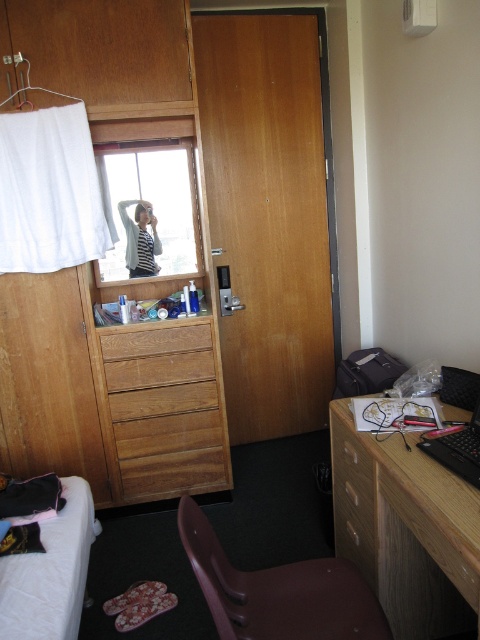
You are organizing your dorm room and want to place a tall plant between the brown wooden drawer at center and the wooden drawer at lower center. Which drawer should you place the plant closer to to ensure it has enough space?

You should place the plant closer to the brown wooden drawer at center because it is much taller than the wooden drawer at lower center, providing more vertical space for the plant.

You are standing in the room and want to move from the point at coordinates point [136,413] to the point at coordinates point [218,582]. Can you walk directly between them without any obstacles?

Point [136,413] is behind point [218,582], so you cannot walk directly between them without going around the obstacle in front.

You are organizing your dorm room and need to place a new bookshelf. You have two wooden drawers in the room. The brown wooden drawer at center and the wooden drawer at lower center. Which drawer is positioned higher up in the room?

The brown wooden drawer at center is positioned higher up in the room as it is above the wooden drawer at lower center.